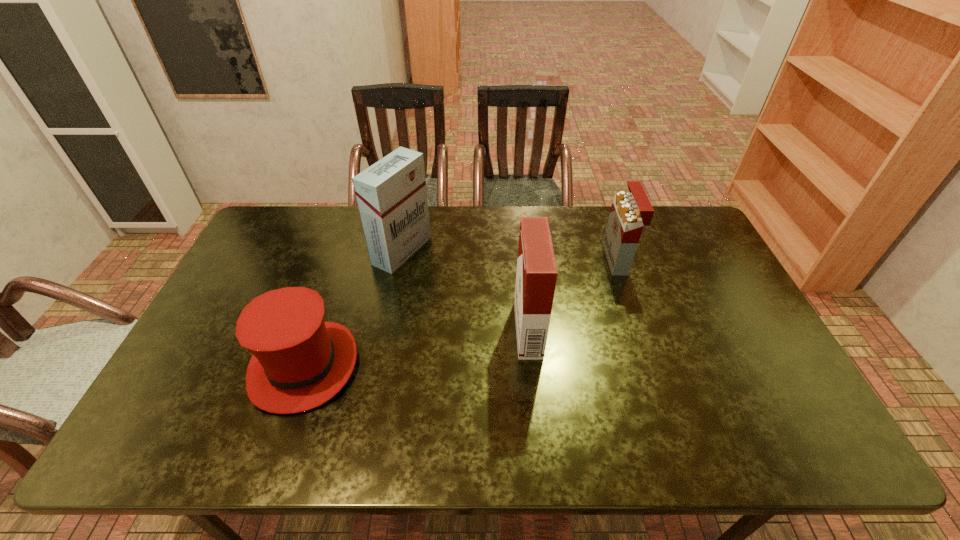
Identify the location of object that is the closest to the leftmost cigarette case. The height and width of the screenshot is (540, 960). (299, 362).

Identify which cigarette case is the closest to the leftmost cigarette case. Please provide its 2D coordinates. Your answer should be formatted as a tuple, i.e. [(x, y)], where the tuple contains the x and y coordinates of a point satisfying the conditions above.

[(536, 275)]

Find the location of a particular element. This screenshot has width=960, height=540. cigarette case that is the second closest to the hat is located at coordinates pos(536,275).

At what (x,y) coordinates should I click in order to perform the action: click on vacant space that satisfies the following two spatial constraints: 1. with the lid open on the shortest cigarette case; 2. on the front side of the hat. Please return your answer as a coordinate pair (x, y). The width and height of the screenshot is (960, 540). Looking at the image, I should click on (653, 366).

Find the location of a particular element. The image size is (960, 540). vacant space that satisfies the following two spatial constraints: 1. with the lid open on the rightmost cigarette case; 2. on the front side of the hat is located at coordinates (653, 366).

Where is `vacant space that satisfies the following two spatial constraints: 1. on the back side of the leftmost cigarette case; 2. on the right side of the hat`? vacant space that satisfies the following two spatial constraints: 1. on the back side of the leftmost cigarette case; 2. on the right side of the hat is located at coordinates (344, 251).

I want to click on free space in the image that satisfies the following two spatial constraints: 1. with the lid open on the third tallest object; 2. on the front side of the shortest object, so click(653, 366).